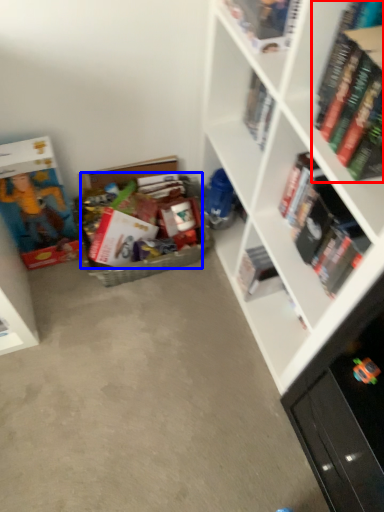
Question: Which object appears closest to the camera in this image, book (highlighted by a red box) or book (highlighted by a blue box)?

Choices:
 (A) book
 (B) book

Answer: (A)